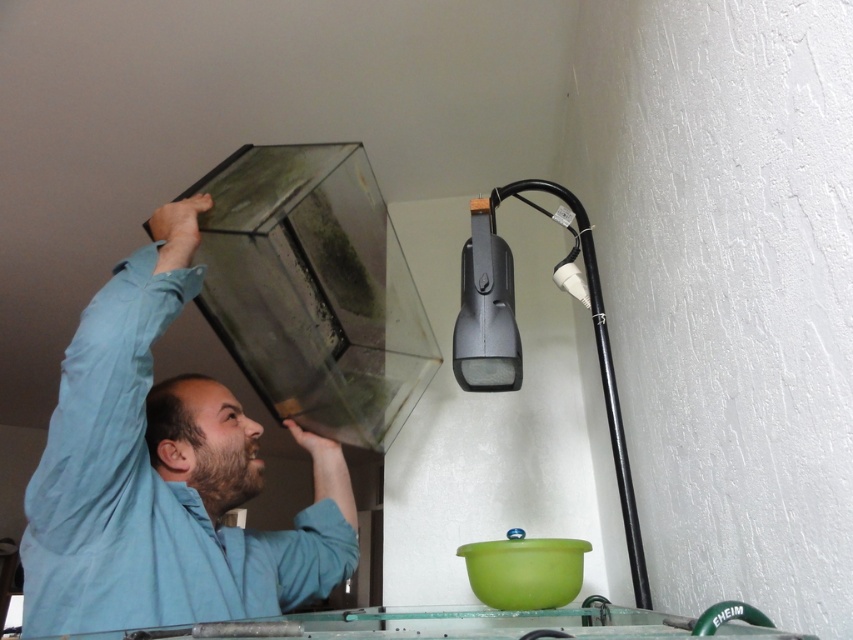
Is blue cotton shirt at upper left positioned at the back of black plastic lamp at upper right?

No, it is not.

Is blue cotton shirt at upper left in front of black plastic lamp at upper right?

Yes, it is in front of black plastic lamp at upper right.

Which is in front, point (169, 221) or point (473, 288)?

Point (473, 288) is more forward.

The image size is (853, 640). Identify the location of blue cotton shirt at upper left. (164, 476).